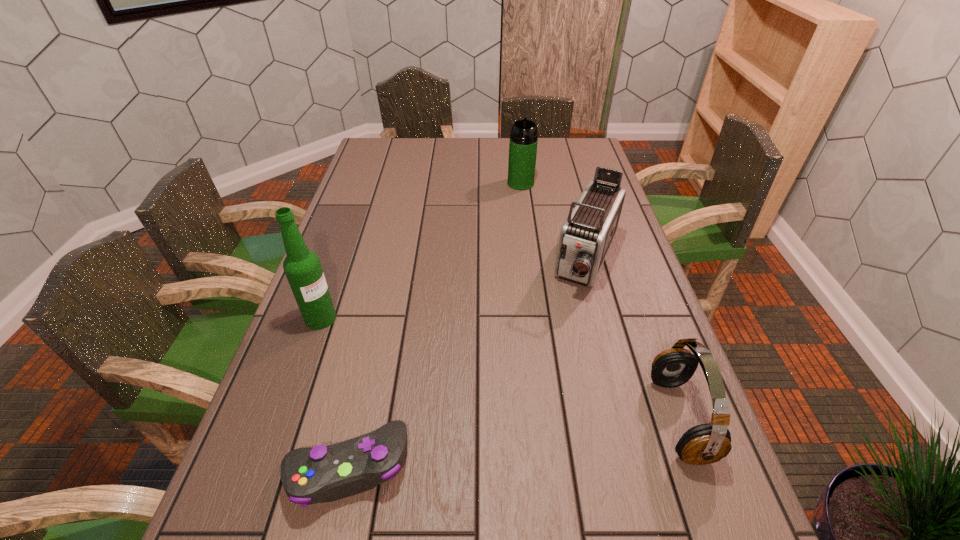
This screenshot has height=540, width=960. Find the location of `beer bottle at the left edge`. beer bottle at the left edge is located at coordinates (302, 267).

Locate an element on the screen. The image size is (960, 540). headset located at the right edge is located at coordinates (708, 443).

This screenshot has width=960, height=540. What are the coordinates of `camcorder that is at the right edge` in the screenshot? It's located at (586, 236).

At what (x,y) coordinates should I click in order to perform the action: click on object at the near left corner. Please return your answer as a coordinate pair (x, y). This screenshot has height=540, width=960. Looking at the image, I should click on (321, 474).

This screenshot has width=960, height=540. In order to click on object located at the near right corner in this screenshot , I will do `click(708, 443)`.

This screenshot has height=540, width=960. In order to click on vacant space at the far edge in this screenshot , I will do `click(494, 146)`.

In the image, there is a desktop. Identify the location of blank space at the near edge. [x=546, y=469].

At what (x,y) coordinates should I click in order to perform the action: click on vacant space at the left edge of the desktop. Please return your answer as a coordinate pair (x, y). Looking at the image, I should click on (355, 231).

Locate an element on the screen. Image resolution: width=960 pixels, height=540 pixels. vacant space at the far left corner is located at coordinates (390, 138).

Where is `vacant space at the far right corner of the desktop`? vacant space at the far right corner of the desktop is located at coordinates (588, 163).